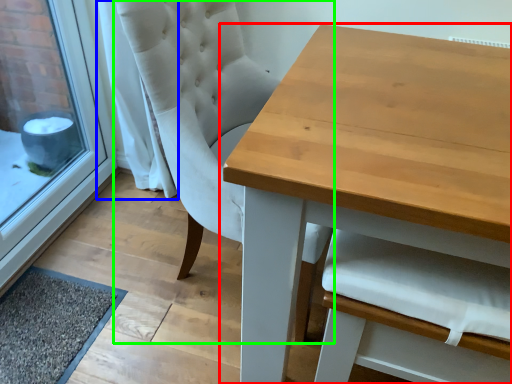
Question: Based on their relative distances, which object is farther from table (highlighted by a red box)? Choose from curtain (highlighted by a blue box) and chair (highlighted by a green box).

Choices:
 (A) curtain
 (B) chair

Answer: (A)